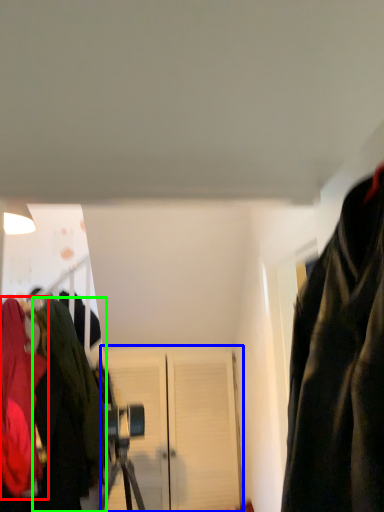
Question: Which object is the closest to the jacket (highlighted by a red box)? Choose among these: door (highlighted by a blue box) or jacket (highlighted by a green box).

Choices:
 (A) door
 (B) jacket

Answer: (B)